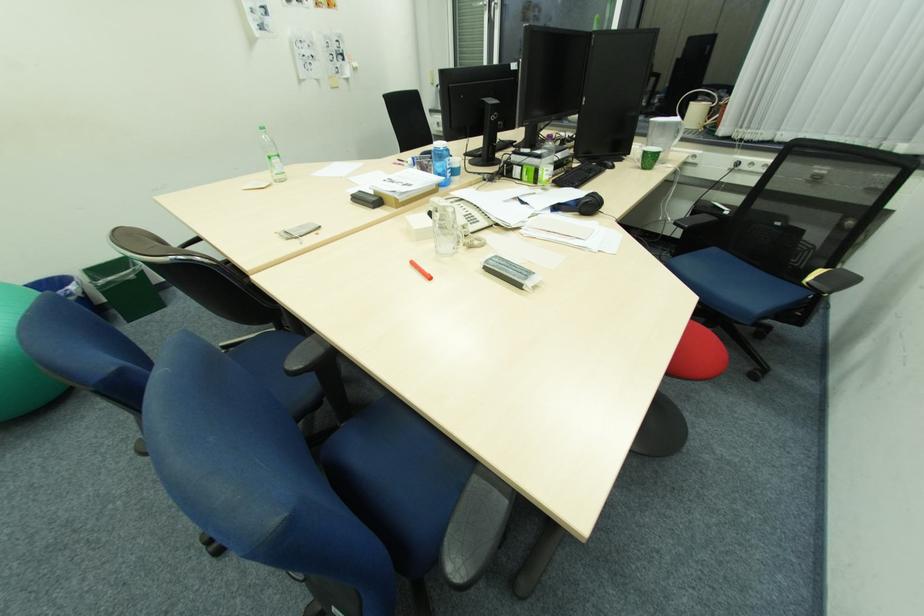
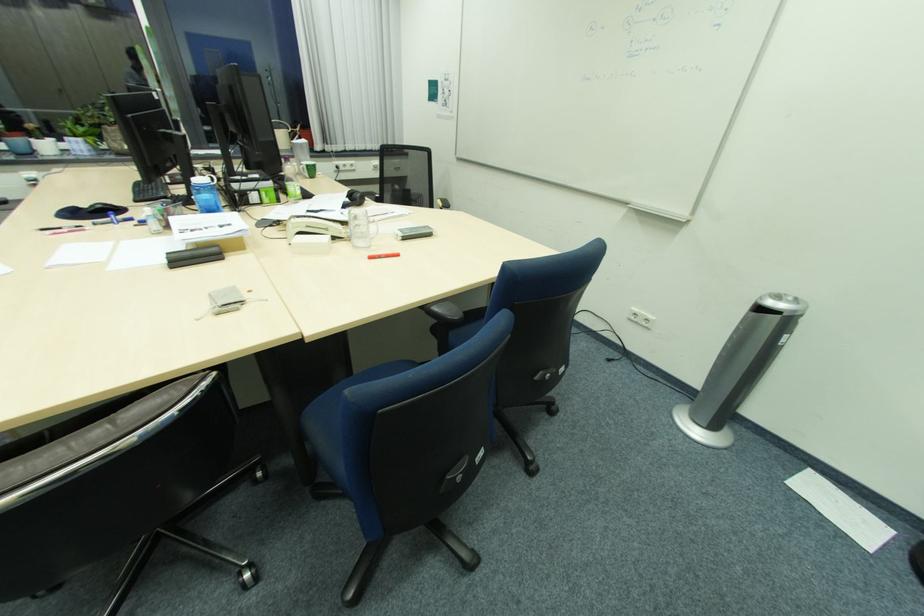
The point at (593, 201) is marked in the first image. Where is the corresponding point in the second image?

(365, 195)